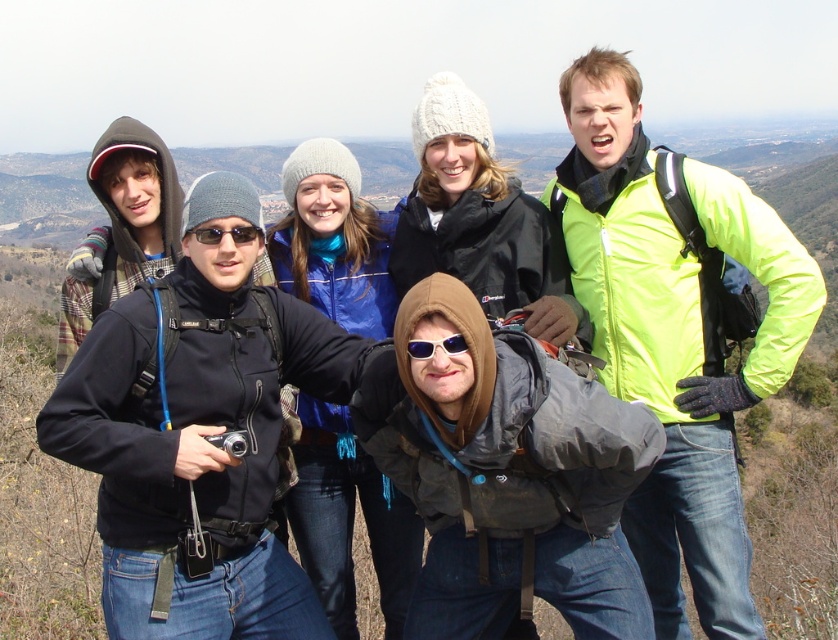
Is neon yellow jacket at upper right wider than black plastic sunglasses at center?

Yes, neon yellow jacket at upper right is wider than black plastic sunglasses at center.

Which is above, neon yellow jacket at upper right or black plastic sunglasses at center?

black plastic sunglasses at center

Who is more forward, [738,564] or [236,241]?

Point [236,241]

Locate an element on the screen. Image resolution: width=838 pixels, height=640 pixels. neon yellow jacket at upper right is located at coordinates (675, 333).

Between sunglasses at center and black plastic sunglasses at center, which one appears on the right side from the viewer's perspective?

From the viewer's perspective, sunglasses at center appears more on the right side.

Can you confirm if sunglasses at center is wider than black plastic sunglasses at center?

No, sunglasses at center is not wider than black plastic sunglasses at center.

Where is `sunglasses at center`? sunglasses at center is located at coordinates (436, 346).

Based on the photo, measure the distance from neon yellow jacket at upper right to sunglasses at center.

neon yellow jacket at upper right is 7.93 meters from sunglasses at center.

In the scene shown: Is the position of neon yellow jacket at upper right more distant than that of sunglasses at center?

Yes, it is.

Does point (665, 625) come behind point (416, 339)?

That is True.

Identify the location of neon yellow jacket at upper right. (675, 333).